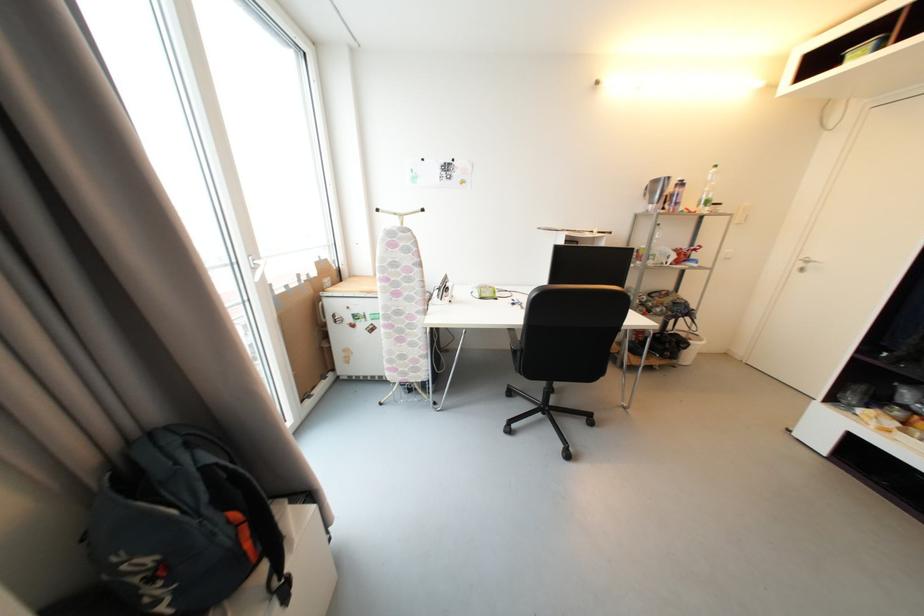
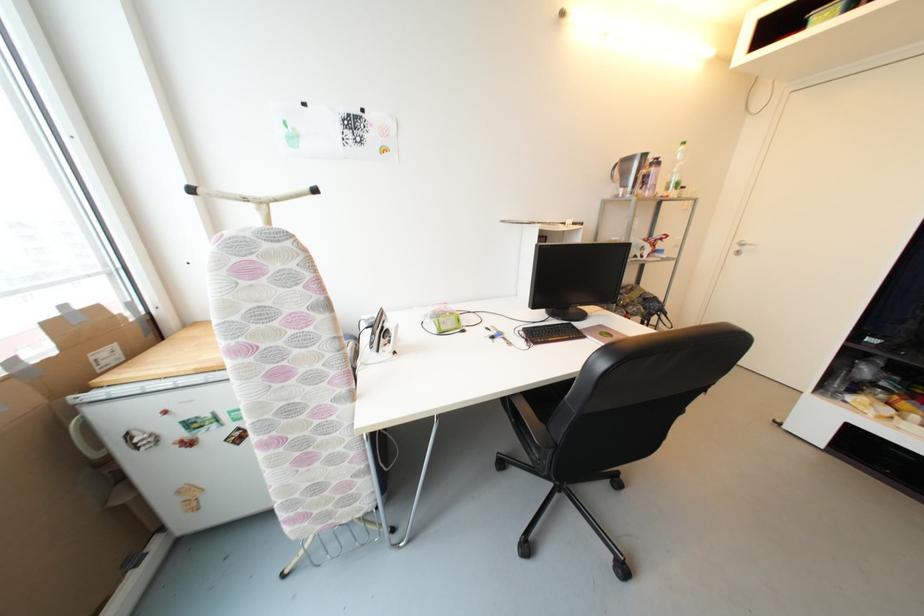
Where in the second image is the point corresponding to (x=454, y=286) from the first image?

(393, 328)